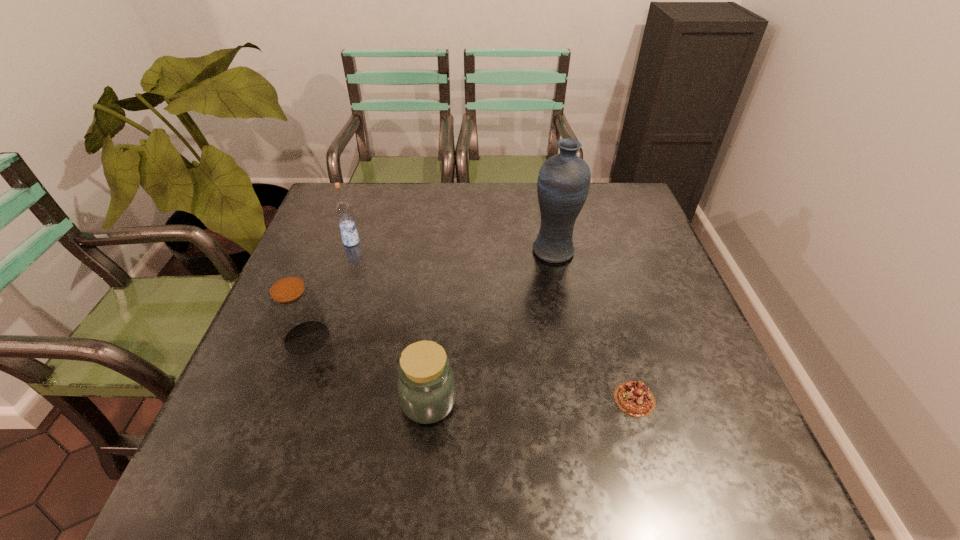
The height and width of the screenshot is (540, 960). In order to click on free spot located 0.280m on the right of the nearer jar in this screenshot , I will do `click(597, 402)`.

Where is `free spot located 0.360m on the left of the chocolate cake`? The width and height of the screenshot is (960, 540). free spot located 0.360m on the left of the chocolate cake is located at coordinates (434, 399).

The image size is (960, 540). What are the coordinates of `vodka at the left edge` in the screenshot? It's located at (343, 210).

I want to click on jar located at the left edge, so tap(295, 309).

The image size is (960, 540). In order to click on object located in the right edge section of the desktop in this screenshot , I will do `click(634, 398)`.

Locate an element on the screen. free space at the far edge of the desktop is located at coordinates (378, 226).

Image resolution: width=960 pixels, height=540 pixels. I want to click on free location at the left edge of the desktop, so click(297, 265).

You are a GUI agent. You are given a task and a screenshot of the screen. Output one action in this format:
    pyautogui.click(x=<x>, y=<y>)
    Task: Click on the vacant space at the right edge of the desktop
    Image resolution: width=960 pixels, height=540 pixels.
    Given the screenshot: What is the action you would take?
    pyautogui.click(x=677, y=291)

Find the location of a particular element. The image size is (960, 540). vacant space at the far left corner is located at coordinates (321, 204).

Where is `vacant space at the far right corner of the desktop`? This screenshot has height=540, width=960. vacant space at the far right corner of the desktop is located at coordinates (620, 222).